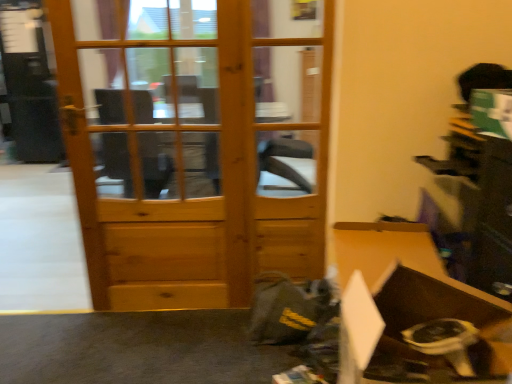
Question: From the image's perspective, relative to natural wood door at left, is brown cardboard box at lower right above or below?

Choices:
 (A) below
 (B) above

Answer: (A)

Question: From a real-world perspective, is brown cardboard box at lower right physically located above or below natural wood door at left?

Choices:
 (A) above
 (B) below

Answer: (B)

Question: Based on their sizes in the image, would you say brown cardboard box at lower right is bigger or smaller than natural wood door at left?

Choices:
 (A) small
 (B) big

Answer: (A)

Question: Considering the relative positions of natural wood door at left and brown cardboard box at lower right in the image provided, is natural wood door at left to the left or to the right of brown cardboard box at lower right?

Choices:
 (A) right
 (B) left

Answer: (B)

Question: Is point (298, 276) closer or farther from the camera than point (355, 354)?

Choices:
 (A) closer
 (B) farther

Answer: (B)

Question: From the image's perspective, is natural wood door at left above or below brown cardboard box at lower right?

Choices:
 (A) below
 (B) above

Answer: (B)

Question: In terms of width, does natural wood door at left look wider or thinner when compared to brown cardboard box at lower right?

Choices:
 (A) thin
 (B) wide

Answer: (A)